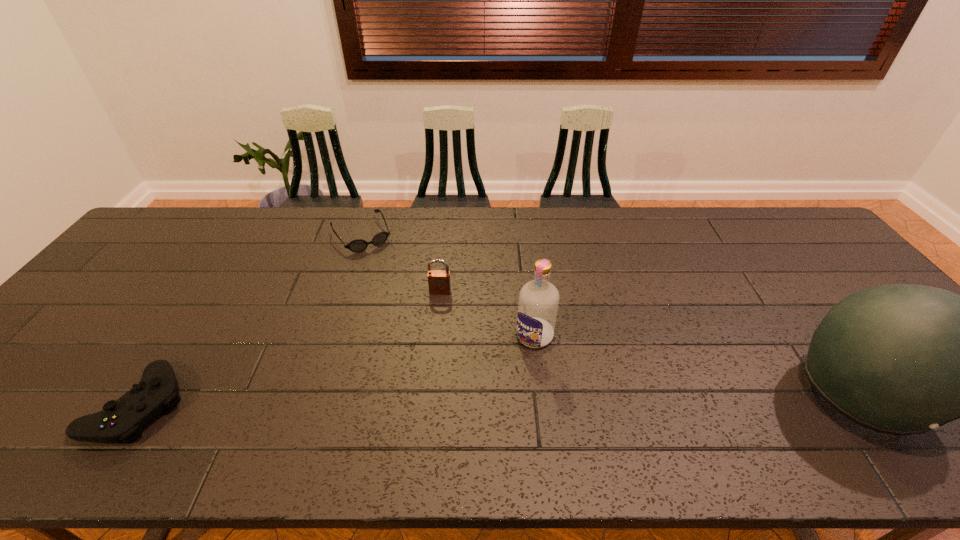
Where is `vacant spot on the desktop that is between the leftmost object and the tallest object and is positioned on the label of the fourth shortest object`? vacant spot on the desktop that is between the leftmost object and the tallest object and is positioned on the label of the fourth shortest object is located at coordinates point(486,399).

Locate an element on the screen. The height and width of the screenshot is (540, 960). free space on the desktop that is between the second shortest object and the rightmost object and is positioned on the front-facing side of the fourth nearest object is located at coordinates [424, 400].

Locate an element on the screen. The image size is (960, 540). free space on the desktop that is between the control and the rightmost object and is positioned on the lenses of the sunglasses is located at coordinates (467, 399).